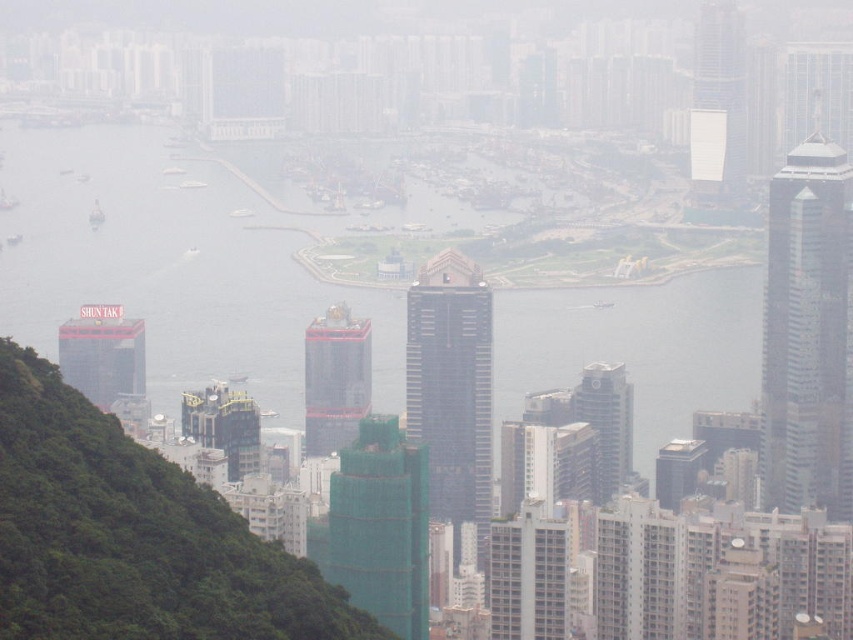
Between point (438, 520) and point (334, 442), which one is positioned in front?

Positioned in front is point (334, 442).

Between point (466, 380) and point (363, 404), which one is positioned behind?

The point (363, 404) is more distant.

Is point (432, 269) in front of point (312, 417)?

Yes, it is in front of point (312, 417).

The height and width of the screenshot is (640, 853). I want to click on dark gray glass skyscraper at center, so click(x=451, y=388).

Which is above, green textured hillside at left or dark gray glass skyscraper at center?

dark gray glass skyscraper at center is higher up.

Does green textured hillside at left have a greater height compared to dark gray glass skyscraper at center?

No, green textured hillside at left is not taller than dark gray glass skyscraper at center.

I want to click on green textured hillside at left, so click(x=132, y=536).

This screenshot has width=853, height=640. I want to click on green textured hillside at left, so (132, 536).

Does green textured hillside at left have a lesser width compared to red brick building at center?

No.

Does green textured hillside at left have a lesser height compared to red brick building at center?

In fact, green textured hillside at left may be taller than red brick building at center.

The width and height of the screenshot is (853, 640). What do you see at coordinates (132, 536) in the screenshot?
I see `green textured hillside at left` at bounding box center [132, 536].

Find the location of `green textured hillside at left`. green textured hillside at left is located at coordinates (132, 536).